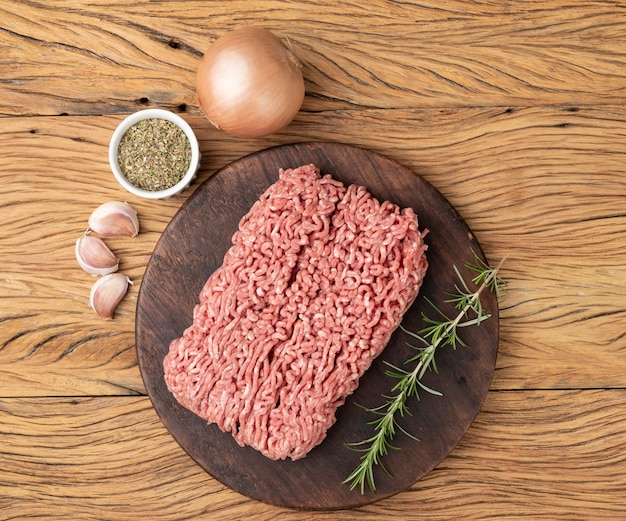
Find the location of a particular element. The height and width of the screenshot is (521, 626). bowl is located at coordinates (187, 182).